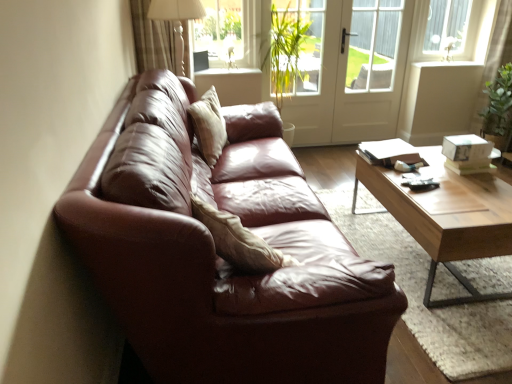
Question: Is matte white table lamp at upper center oriented towards transparent glass window at upper center?

Choices:
 (A) yes
 (B) no

Answer: (B)

Question: Can you confirm if matte white table lamp at upper center is smaller than transparent glass window at upper center?

Choices:
 (A) no
 (B) yes

Answer: (A)

Question: Is the depth of matte white table lamp at upper center greater than that of transparent glass window at upper center?

Choices:
 (A) yes
 (B) no

Answer: (B)

Question: Could transparent glass window at upper center be considered to be inside matte white table lamp at upper center?

Choices:
 (A) yes
 (B) no

Answer: (B)

Question: Is matte white table lamp at upper center positioned in front of transparent glass window at upper center?

Choices:
 (A) no
 (B) yes

Answer: (B)

Question: Does matte white table lamp at upper center appear on the left side of transparent glass window at upper center?

Choices:
 (A) no
 (B) yes

Answer: (B)

Question: Does transparent glass window at upper center have a greater height compared to light brown wooden coffee table at center?

Choices:
 (A) no
 (B) yes

Answer: (B)

Question: Is transparent glass window at upper center looking in the opposite direction of light brown wooden coffee table at center?

Choices:
 (A) no
 (B) yes

Answer: (A)

Question: Is the depth of transparent glass window at upper center less than that of light brown wooden coffee table at center?

Choices:
 (A) yes
 (B) no

Answer: (B)

Question: From a real-world perspective, is transparent glass window at upper center beneath light brown wooden coffee table at center?

Choices:
 (A) no
 (B) yes

Answer: (A)

Question: Does transparent glass window at upper center have a smaller size compared to light brown wooden coffee table at center?

Choices:
 (A) no
 (B) yes

Answer: (B)

Question: Considering the relative sizes of transparent glass window at upper center and light brown wooden coffee table at center in the image provided, is transparent glass window at upper center shorter than light brown wooden coffee table at center?

Choices:
 (A) yes
 (B) no

Answer: (B)

Question: Is green leafy plant at center taller than light brown wooden coffee table at center?

Choices:
 (A) no
 (B) yes

Answer: (B)